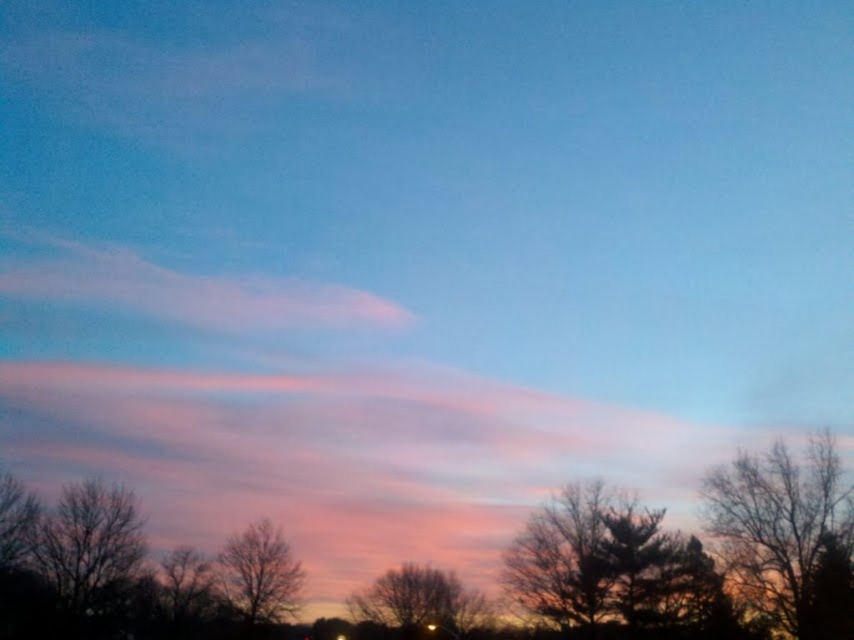
Who is positioned more to the left, silhouette bare tree at right or bare branches at center?

From the viewer's perspective, bare branches at center appears more on the left side.

Locate an element on the screen. This screenshot has height=640, width=854. silhouette bare tree at right is located at coordinates (782, 529).

Identify the location of silhouette bare tree at right. (782, 529).

The image size is (854, 640). What do you see at coordinates (598, 561) in the screenshot?
I see `silhouette bare tree at center` at bounding box center [598, 561].

Is silhouette bare tree at center shorter than bare branches at center?

No, silhouette bare tree at center is not shorter than bare branches at center.

Does point (654, 570) come behind point (375, 614)?

No, it is in front of (375, 614).

The height and width of the screenshot is (640, 854). In order to click on silhouette bare tree at center in this screenshot , I will do click(x=598, y=561).

The width and height of the screenshot is (854, 640). What do you see at coordinates (185, 291) in the screenshot?
I see `pink translucent cloud at upper left` at bounding box center [185, 291].

Is pink translucent cloud at upper left above bare branches at center?

Correct, pink translucent cloud at upper left is located above bare branches at center.

At what (x,y) coordinates should I click in order to perform the action: click on pink translucent cloud at upper left. Please return your answer as a coordinate pair (x, y). Image resolution: width=854 pixels, height=640 pixels. Looking at the image, I should click on (185, 291).